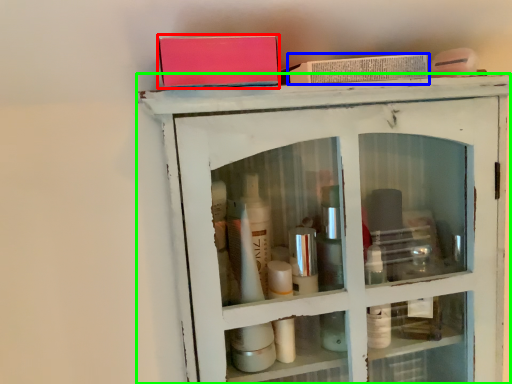
Question: Based on their relative distances, which object is nearer to book (highlighted by a red box)? Choose from book (highlighted by a blue box) and shelf (highlighted by a green box).

Choices:
 (A) book
 (B) shelf

Answer: (A)